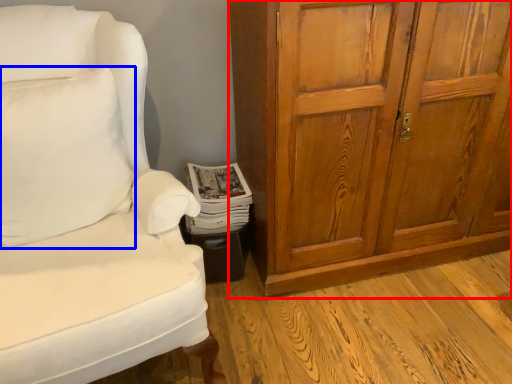
Question: Which point is further to the camera, cabinetry (highlighted by a red box) or pillow (highlighted by a blue box)?

Choices:
 (A) cabinetry
 (B) pillow

Answer: (A)